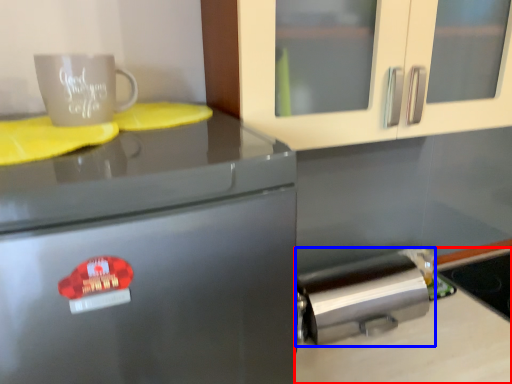
Question: Which point is closer to the camera, counter top (highlighted by a red box) or kitchen appliance (highlighted by a blue box)?

Choices:
 (A) counter top
 (B) kitchen appliance

Answer: (A)